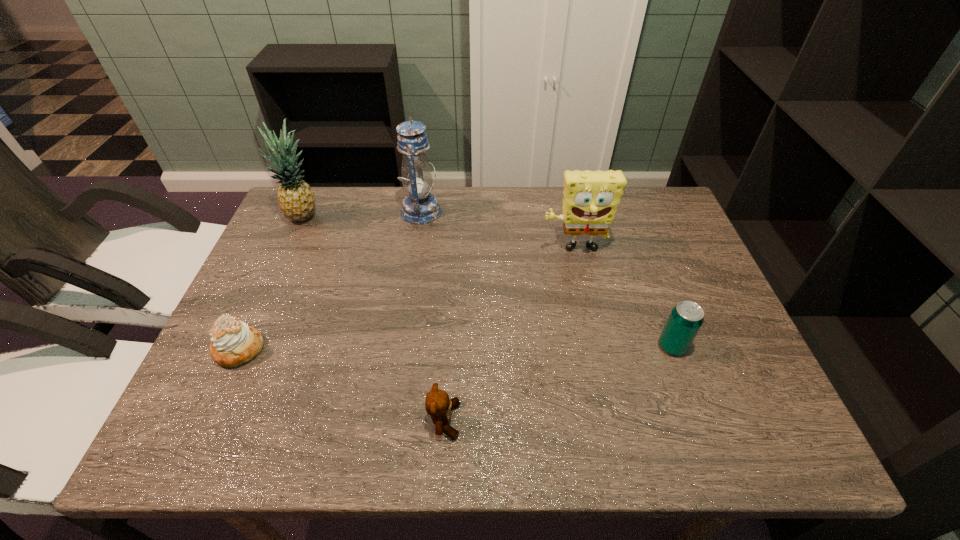
This screenshot has height=540, width=960. I want to click on vacant area that lies between the pastry and the lantern, so click(x=330, y=281).

At what (x,y) coordinates should I click in order to perform the action: click on vacant region between the pineapple and the lantern. Please return your answer as a coordinate pair (x, y). Looking at the image, I should click on (363, 214).

At what (x,y) coordinates should I click in order to perform the action: click on empty space between the fourth nearest object and the third object from right to left. Please return your answer as a coordinate pair (x, y). The width and height of the screenshot is (960, 540). Looking at the image, I should click on tap(509, 335).

Identify the location of vacant space that is in between the pastry and the rightmost object. The image size is (960, 540). (456, 348).

At what (x,y) coordinates should I click in order to perform the action: click on vacant space that's between the pineapple and the fourth object from left to right. Please return your answer as a coordinate pair (x, y). The height and width of the screenshot is (540, 960). Looking at the image, I should click on (374, 319).

Identify the location of empty location between the third object from right to left and the third object from left to right. (433, 316).

Image resolution: width=960 pixels, height=540 pixels. I want to click on free space between the teddy bear and the third farthest object, so [x=509, y=335].

This screenshot has width=960, height=540. Find the location of `vacant area that lies between the pastry and the teddy bear`. vacant area that lies between the pastry and the teddy bear is located at coordinates (342, 385).

Locate which object ranks in proximity to the fourth nearest object. Please provide its 2D coordinates. Your answer should be formatted as a tuple, i.e. [(x, y)], where the tuple contains the x and y coordinates of a point satisfying the conditions above.

[(686, 318)]

Identify which object is the fifth nearest to the teddy bear. Please provide its 2D coordinates. Your answer should be formatted as a tuple, i.e. [(x, y)], where the tuple contains the x and y coordinates of a point satisfying the conditions above.

[(296, 199)]